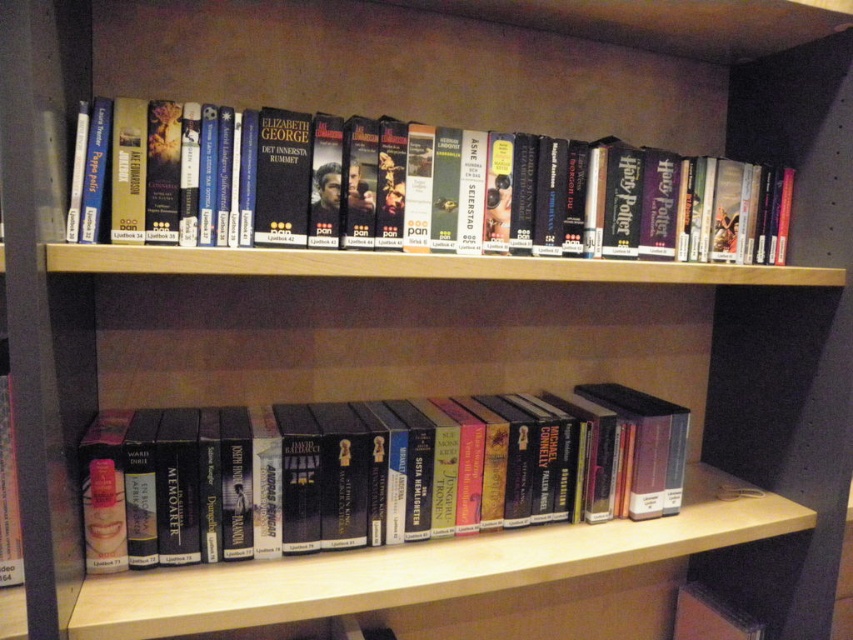
You are a librarian organizing books on a shelf. You need to place a new book exactly at the center of the shelf. The existing books include the hardcover book at center represented by point (376, 472). Can you confirm if the new book will be placed correctly?

The hardcover book at center is already at the center of the shelf, so placing the new book there would mean it is correctly centered.

You are organizing a bookshelf and need to move the hardcover book at center and the hardcover book at upper center. Which book should you move first to avoid disturbing the other?

You should move the hardcover book at upper center first because it is above the hardcover book at center, so moving it first will prevent it from affecting the position of the lower book.